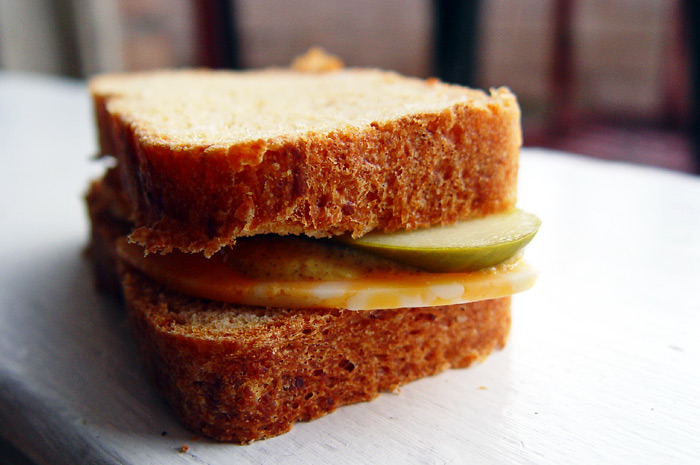
Find the location of a particular element. The height and width of the screenshot is (465, 700). wood table is located at coordinates (561, 384).